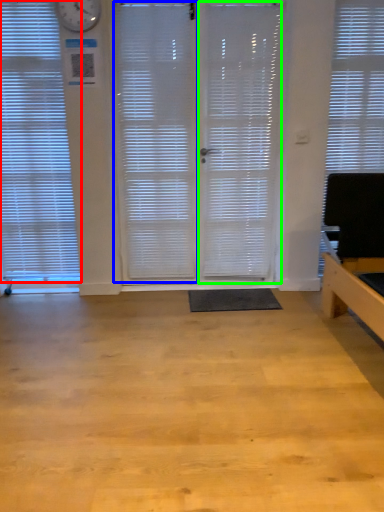
Question: Which object is positioned closest to window blind (highlighted by a red box)? Select from shutter (highlighted by a blue box) and screen door (highlighted by a green box).

Choices:
 (A) shutter
 (B) screen door

Answer: (A)